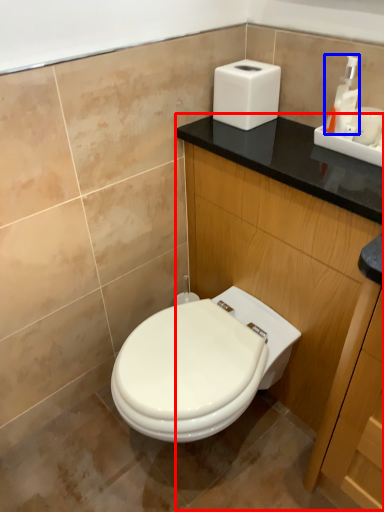
Question: Among these objects, which one is nearest to the camera, dresser (highlighted by a red box) or soap dispenser (highlighted by a blue box)?

Choices:
 (A) dresser
 (B) soap dispenser

Answer: (A)